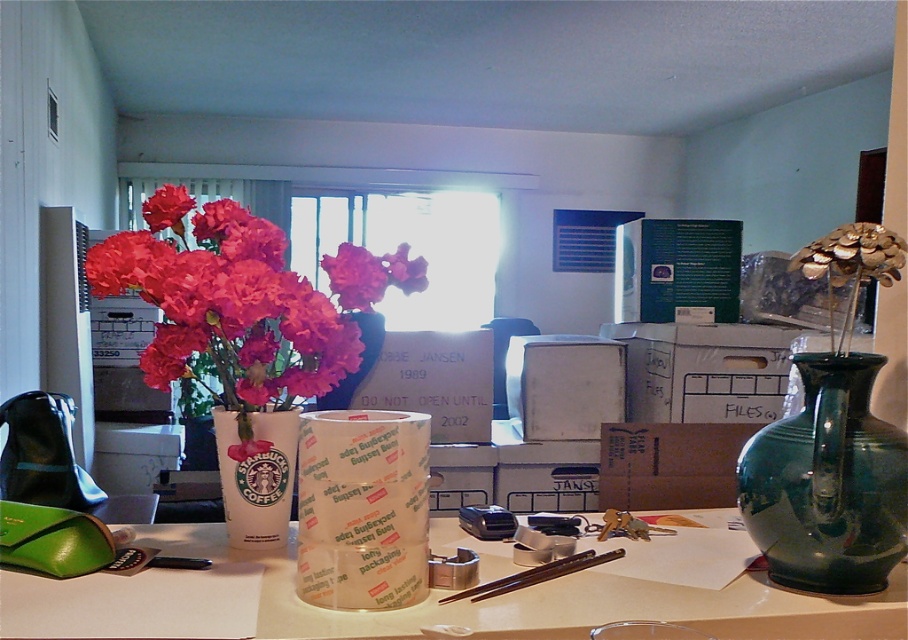
Question: Does matte ceramic vase at upper left appear on the left side of matte pink flower at upper left?

Choices:
 (A) yes
 (B) no

Answer: (B)

Question: Can you confirm if matte ceramic vase at upper left is positioned above matte pink petals at center?

Choices:
 (A) no
 (B) yes

Answer: (A)

Question: Estimate the real-world distances between objects in this image. Which object is farther from the white cardboard box at center?

Choices:
 (A) matte pink petals at center
 (B) white paper at center
 (C) matte pink flower at center
 (D) green glossy vase at right

Answer: (A)

Question: Considering the real-world distances, which object is closest to the white paper cup at center?

Choices:
 (A) pink matte flower at center
 (B) matte pink petals at center

Answer: (A)

Question: Which of the following is the closest to the observer?

Choices:
 (A) (334, 282)
 (B) (284, 500)
 (C) (686, 497)
 (D) (558, 584)

Answer: (D)

Question: Does matte pink flower at upper left appear on the right side of matte pink flower at center?

Choices:
 (A) no
 (B) yes

Answer: (A)